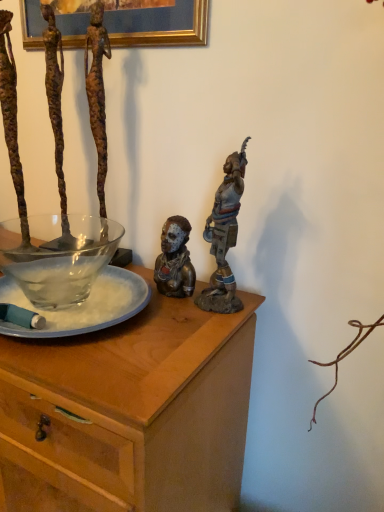
You are a GUI agent. You are given a task and a screenshot of the screen. Output one action in this format:
    pyautogui.click(x=<x>, y=<y>)
    Task: Click on the vacant area that is in front of bronze statue at center, the 2th person in the right-to-left sequence
    
    Given the screenshot: What is the action you would take?
    pyautogui.click(x=176, y=331)